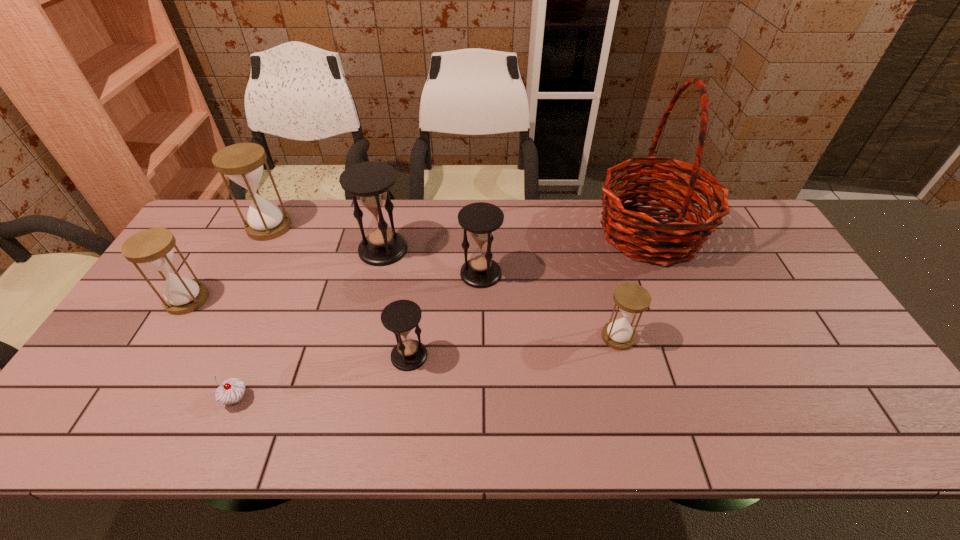
You are a GUI agent. You are given a task and a screenshot of the screen. Output one action in this format:
    pyautogui.click(x=<x>, y=<y>)
    Task: Click on the closest object to the second smallest white hourglass
    
    Given the screenshot: What is the action you would take?
    pyautogui.click(x=243, y=163)

This screenshot has width=960, height=540. Identify the location of the fifth closest hourglass to the third hourglass from right to left. (243, 163).

At what (x,y) coordinates should I click in order to perform the action: click on hourglass object that ranks as the closest to the biggest white hourglass. Please return your answer as a coordinate pair (x, y). Looking at the image, I should click on (153, 248).

Locate an element on the screen. black hourglass that stands as the second closest to the fourth hourglass from right to left is located at coordinates (400, 317).

The width and height of the screenshot is (960, 540). I want to click on the third closest black hourglass to the tallest object, so click(370, 181).

Identify which white hourglass is the nearest to the second biggest white hourglass. Please provide its 2D coordinates. Your answer should be formatted as a tuple, i.e. [(x, y)], where the tuple contains the x and y coordinates of a point satisfying the conditions above.

[(243, 163)]

Where is `the closest white hourglass to the second black hourglass from right to left`? The image size is (960, 540). the closest white hourglass to the second black hourglass from right to left is located at coordinates (630, 298).

The height and width of the screenshot is (540, 960). I want to click on free location that satisfies the following two spatial constraints: 1. on the back side of the tallest object; 2. on the left side of the smallest black hourglass, so click(425, 233).

What are the coordinates of `vacant area that satisfies the following two spatial constraints: 1. on the back side of the rightmost hourglass; 2. on the right side of the nearest black hourglass` in the screenshot? It's located at (412, 337).